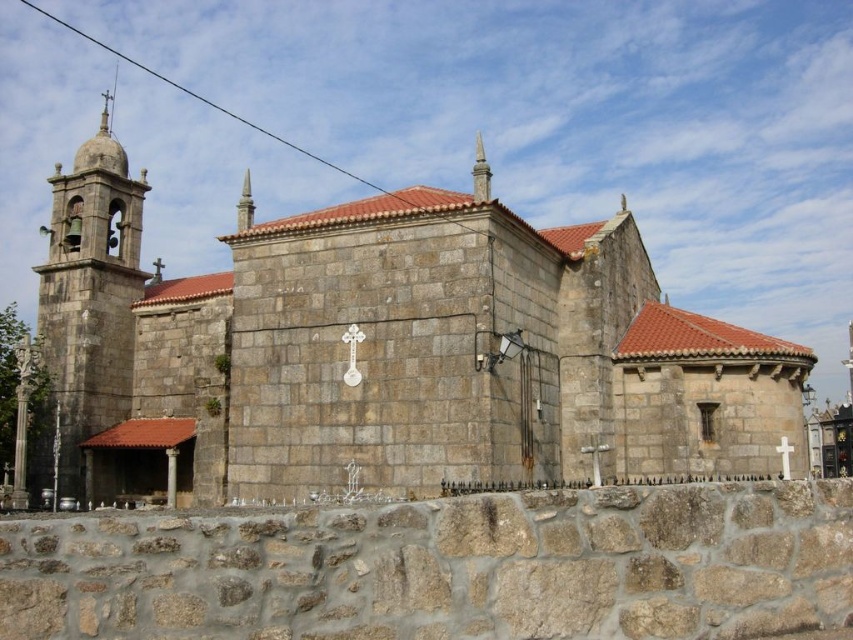
You are a tourist standing in front of the stone church at center and the stone bell tower at upper left. Which one is located more to the left side of the image?

The stone bell tower at upper left is more to the left side of the image because the stone church at center is positioned on the right side of it.

You are standing at the entrance of the stone church at center. If you walk straight ahead, will you exit the church grounds through the main gate located at point 0.600, 0.500?

The stone church at center is located at point (386, 352). The main gate is at point (426, 384). Since the coordinates are close, walking straight ahead might lead you towards the main gate, but the exact path depends on the layout of the church grounds which isn not specified. However, based on the given coordinates, the main gate is slightly northeast of the church, so walking straight ahead from the entrance could align with that direction.